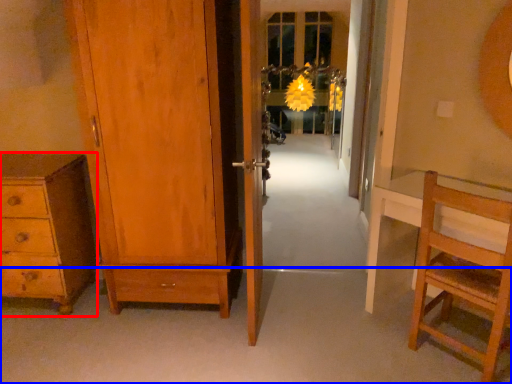
Question: Which object appears closest to the camera in this image, chest of drawers (highlighted by a red box) or path (highlighted by a blue box)?

Choices:
 (A) chest of drawers
 (B) path

Answer: (B)